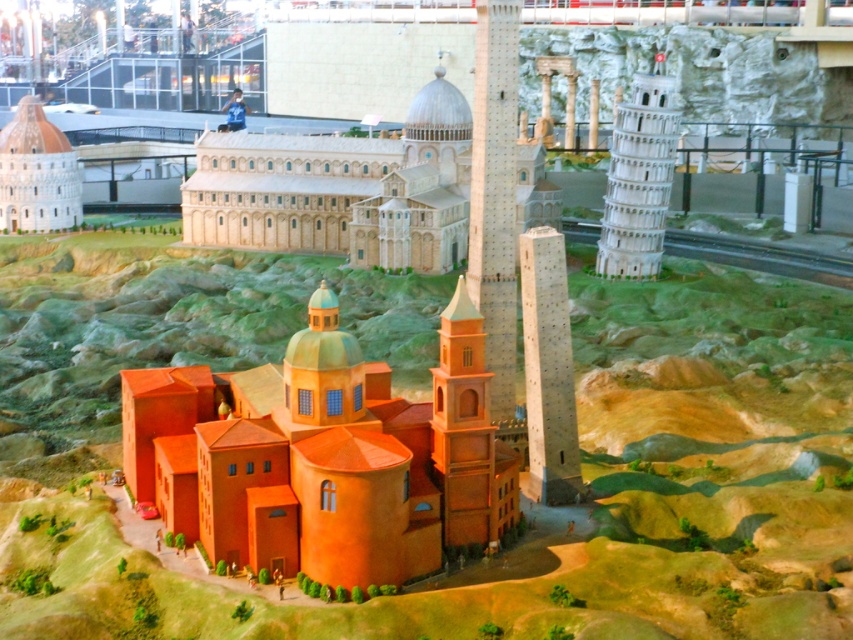
You are a tourist in the miniature city and want to find the light brown stone church at center. From your current position at the orange clay terrain at center, in which direction should you move to reach the church?

Since the orange clay terrain at center is to the left of the light brown stone church at center, you should move to the right to reach the church.

You are an architect examining the miniature city model. You need to determine the spatial relationship between the orange clay church at center and the matte white dome at upper left. Which object is located below the other?

The orange clay church at center is positioned under the matte white dome at upper left, meaning the church is below the dome.